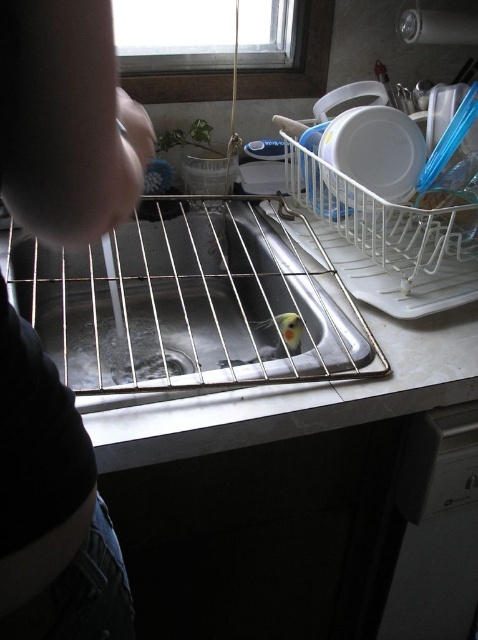
Question: Is dark fabric shirt at left thinner than stainless steel sink at center?

Choices:
 (A) yes
 (B) no

Answer: (A)

Question: Based on their relative distances, which object is nearer to the dark fabric shirt at left?

Choices:
 (A) stainless steel sink at center
 (B) yellow-green parrot at sink center
 (C) white plastic dishwasher at lower right

Answer: (B)

Question: Estimate the real-world distances between objects in this image. Which object is closer to the yellow-green parrot at sink center?

Choices:
 (A) dark fabric shirt at left
 (B) stainless steel sink at center

Answer: (B)

Question: Considering the relative positions of stainless steel sink at center and white plastic dishwasher at lower right in the image provided, where is stainless steel sink at center located with respect to white plastic dishwasher at lower right?

Choices:
 (A) below
 (B) above

Answer: (B)

Question: Which of these objects is positioned closest to the stainless steel sink at center?

Choices:
 (A) white plastic dishwasher at lower right
 (B) yellow-green parrot at sink center

Answer: (B)

Question: Is white plastic dishwasher at lower right positioned in front of yellow-green parrot at sink center?

Choices:
 (A) no
 (B) yes

Answer: (A)